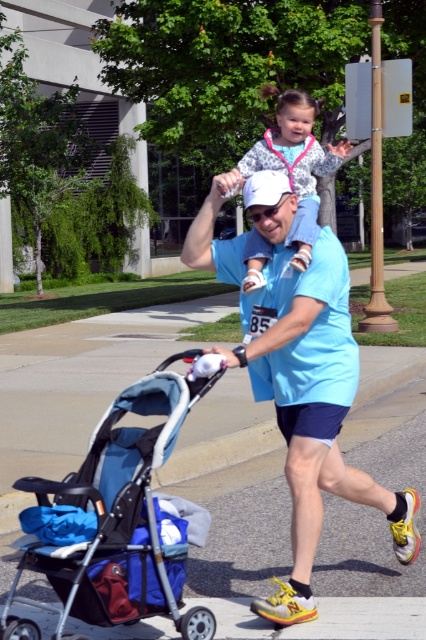
You are a photographer trying to capture the man and child in the scene. If you want to focus on the speckled fleece jacket at upper center while keeping the blue fabric stroller at lower left in the background, is this possible?

The blue fabric stroller at lower left is closer to the viewer than the speckled fleece jacket at upper center, so focusing on the speckled fleece jacket at upper center while keeping the blue fabric stroller at lower left in the background is not possible because the stroller is in front of the jacket.

You are a photographer trying to capture the entire scene in one shot. The blue fabric stroller at lower left and the speckled fleece jacket at upper center are both in your viewfinder. Which object should you adjust your focus on to ensure both fit in the frame without cropping?

Since the blue fabric stroller at lower left occupies less space than the speckled fleece jacket at upper center, you should focus on the larger object, the speckled fleece jacket at upper center, to ensure both fit in the frame without cropping.